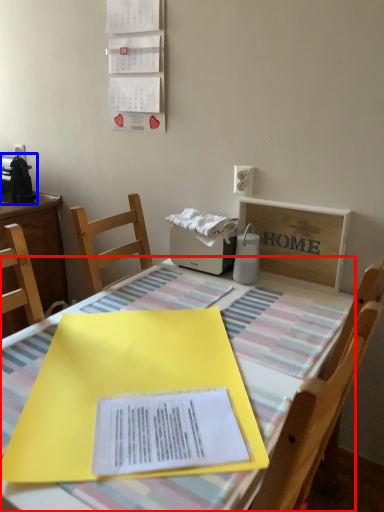
Question: Which object appears farthest to the camera in this image, table (highlighted by a red box) or appliance (highlighted by a blue box)?

Choices:
 (A) table
 (B) appliance

Answer: (B)